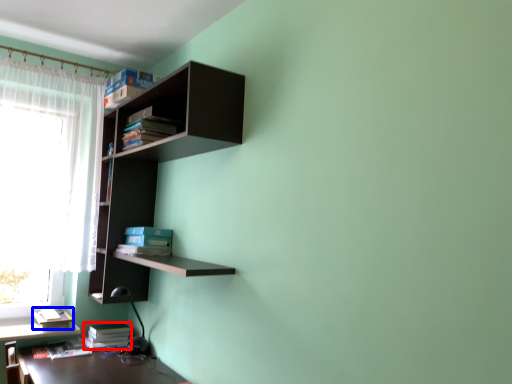
Question: Which point is further to the camera, book (highlighted by a red box) or book (highlighted by a blue box)?

Choices:
 (A) book
 (B) book

Answer: (A)